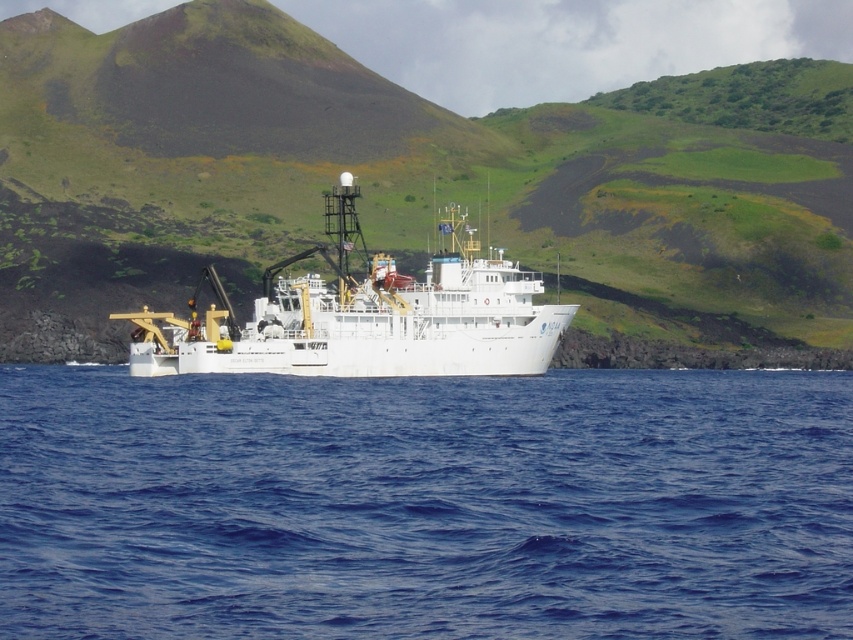
Question: Which object is closer to the camera taking this photo?

Choices:
 (A) white matte ship at center
 (B) blue liquid water at center

Answer: (B)

Question: Is the position of blue liquid water at center more distant than that of green grassy hillside at center?

Choices:
 (A) no
 (B) yes

Answer: (A)

Question: Where is blue liquid water at center located in relation to green grassy hillside at center in the image?

Choices:
 (A) left
 (B) right

Answer: (B)

Question: Which is nearer to the white matte ship at center?

Choices:
 (A) blue liquid water at center
 (B) green grassy hillside at center

Answer: (A)

Question: Considering the real-world distances, which object is closest to the green grassy hillside at center?

Choices:
 (A) blue liquid water at center
 (B) white matte ship at center

Answer: (B)

Question: Can you confirm if blue liquid water at center is positioned above green grassy hillside at center?

Choices:
 (A) yes
 (B) no

Answer: (B)